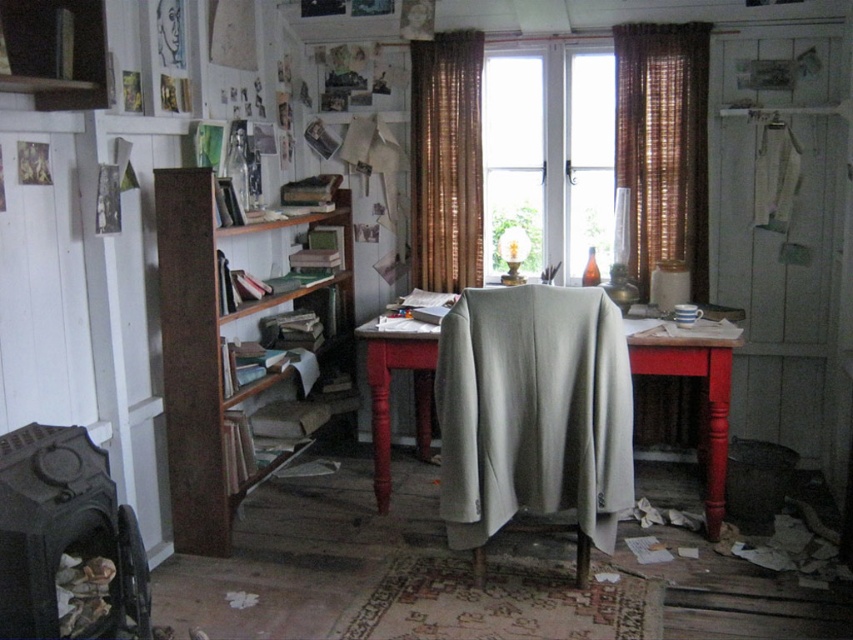
You are sitting at the desk and notice two items in front of you. Which object is closer to you, the light gray fabric at center or the white glass window at center?

The light gray fabric at center is closer to you because it is in front of the white glass window at center.